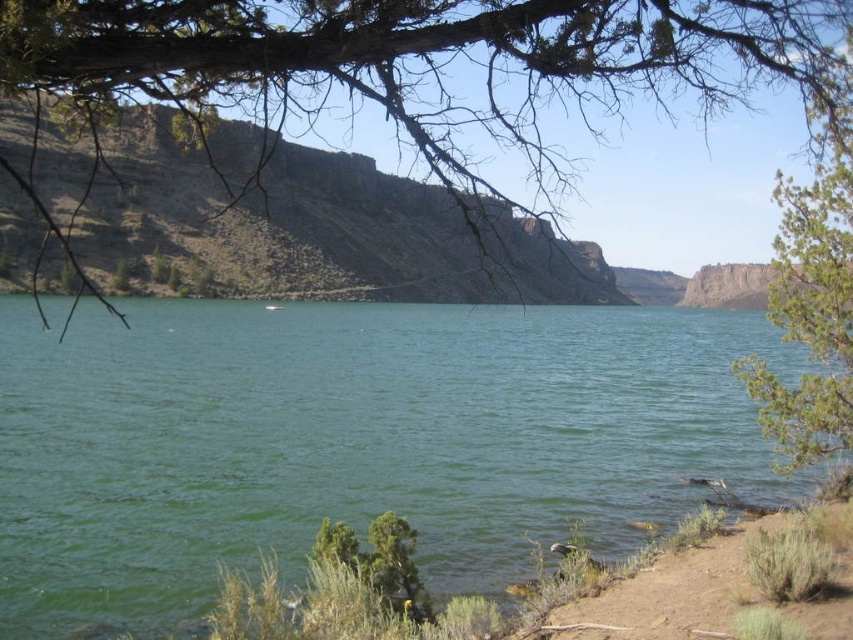
Question: Is brown rocky cliff at upper center positioned in front of rugged rock cliff at upper right?

Choices:
 (A) yes
 (B) no

Answer: (A)

Question: Is brown rocky cliff at upper center thinner than brown dirt at lower right?

Choices:
 (A) no
 (B) yes

Answer: (A)

Question: Among these objects, which one is farthest from the camera?

Choices:
 (A) green leafy tree at upper left
 (B) brown dirt at lower right
 (C) rugged rock cliff at upper right
 (D) brown rocky cliff at upper center

Answer: (C)

Question: Is green water at center to the right of rugged rock cliff at upper right from the viewer's perspective?

Choices:
 (A) no
 (B) yes

Answer: (A)

Question: Which point appears farthest from the camera in this image?

Choices:
 (A) (785, 580)
 (B) (465, 228)
 (C) (747, 305)

Answer: (C)

Question: Among these objects, which one is farthest from the camera?

Choices:
 (A) rugged rock cliff at upper right
 (B) green water at center
 (C) green leafy tree at upper left

Answer: (A)